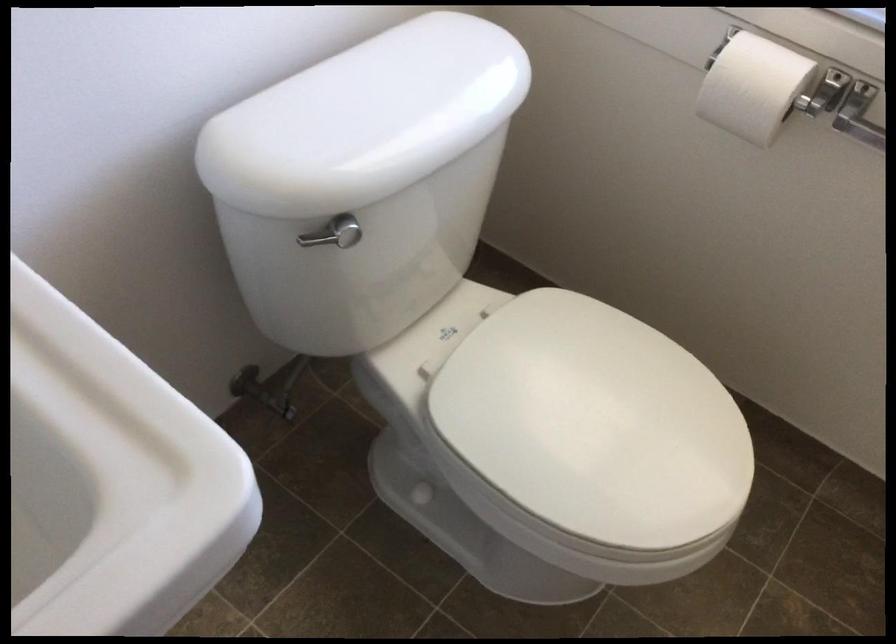
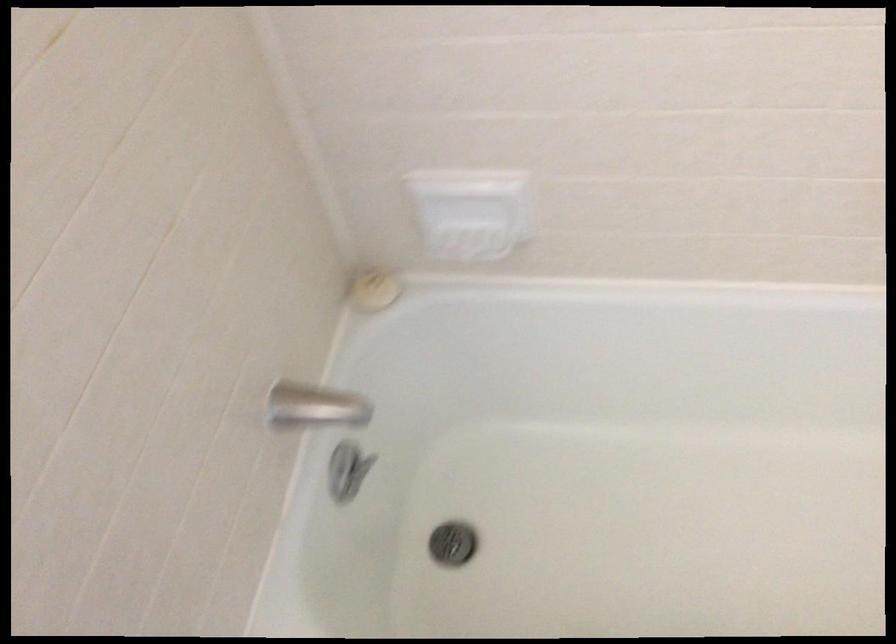
Based on the continuous images, in which direction is the camera rotating?

The camera's rotation is toward right-down.